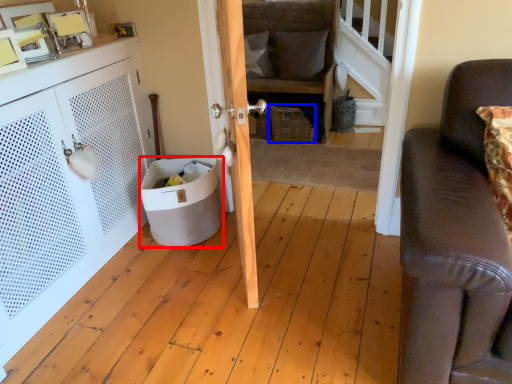
Question: Which object is closer to the camera taking this photo, trash bin/can (highlighted by a red box) or basket (highlighted by a blue box)?

Choices:
 (A) trash bin/can
 (B) basket

Answer: (A)